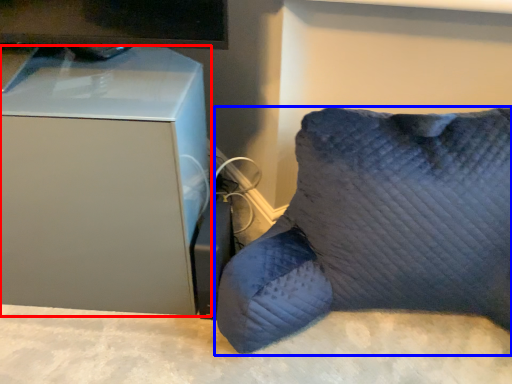
Question: Which object is further to the camera taking this photo, furniture (highlighted by a red box) or furniture (highlighted by a blue box)?

Choices:
 (A) furniture
 (B) furniture

Answer: (A)